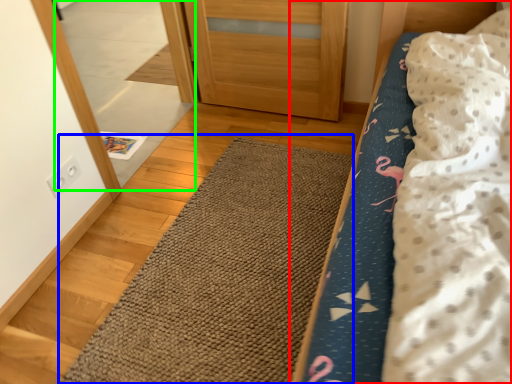
Question: Considering the real-world distances, which object is farthest from bed (highlighted by a red box)? doormat (highlighted by a blue box) or mirror (highlighted by a green box)?

Choices:
 (A) doormat
 (B) mirror

Answer: (B)